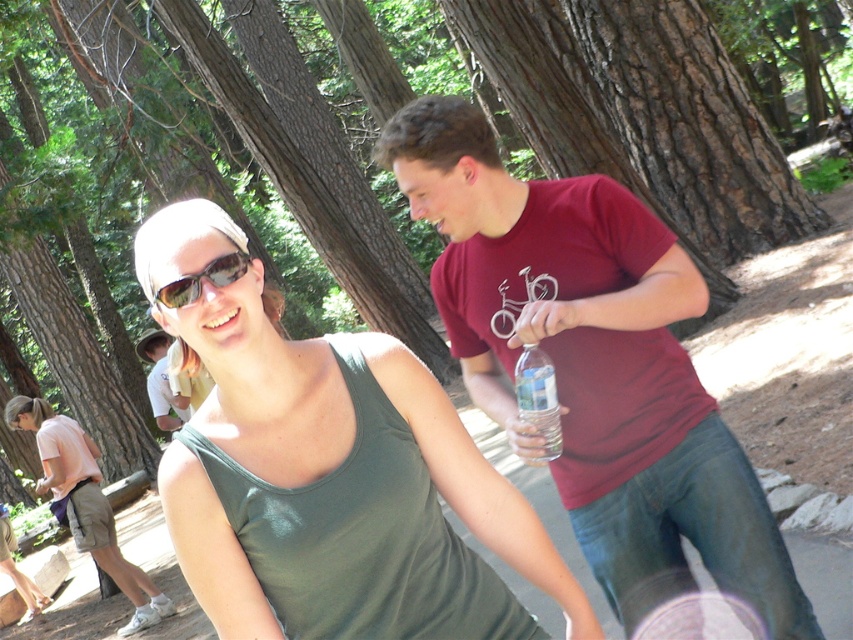
You are a hiker who just finished a long trek and are now sitting on a rock in the forest. You have a clear plastic bottle at center and sunglasses at center. Which item is closer to the ground?

The clear plastic bottle at center is positioned under sunglasses at center, so the clear plastic bottle at center is closer to the ground.